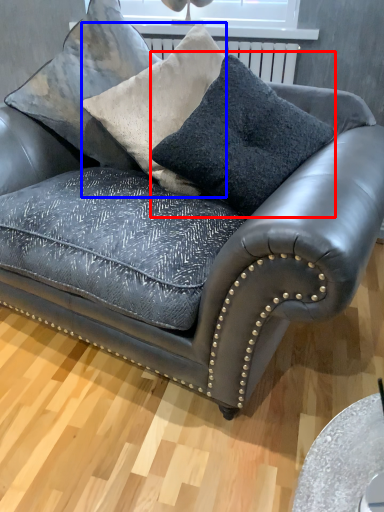
Question: Which object appears closest to the camera in this image, throw pillow (highlighted by a red box) or throw pillow (highlighted by a blue box)?

Choices:
 (A) throw pillow
 (B) throw pillow

Answer: (A)